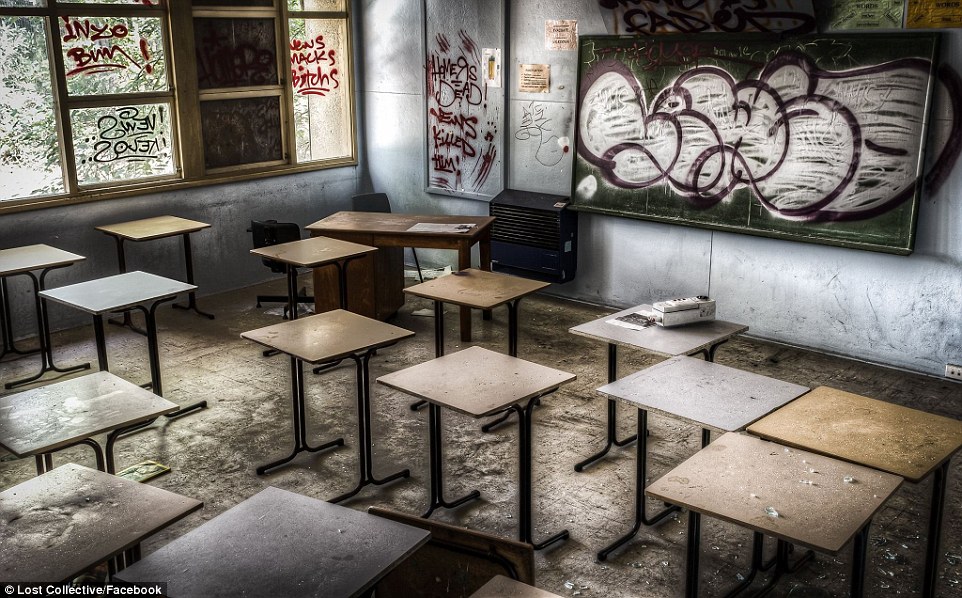
The width and height of the screenshot is (962, 598). I want to click on tan desks, so click(490, 387), click(24, 262), click(751, 468), click(146, 507).